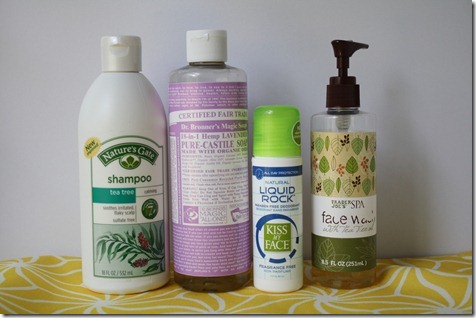
Find the location of a particular element. Image resolution: width=476 pixels, height=318 pixels. white background wall is located at coordinates (45, 116).